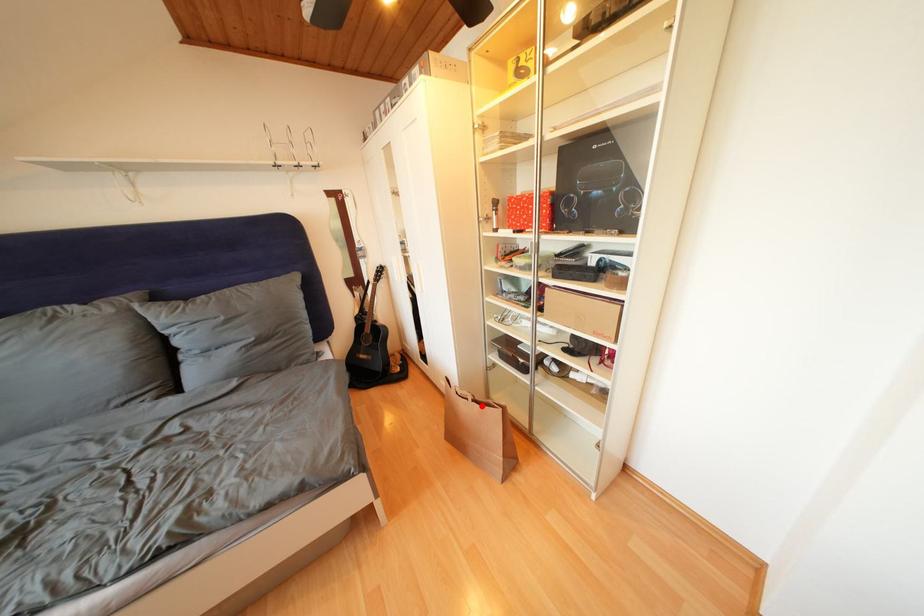
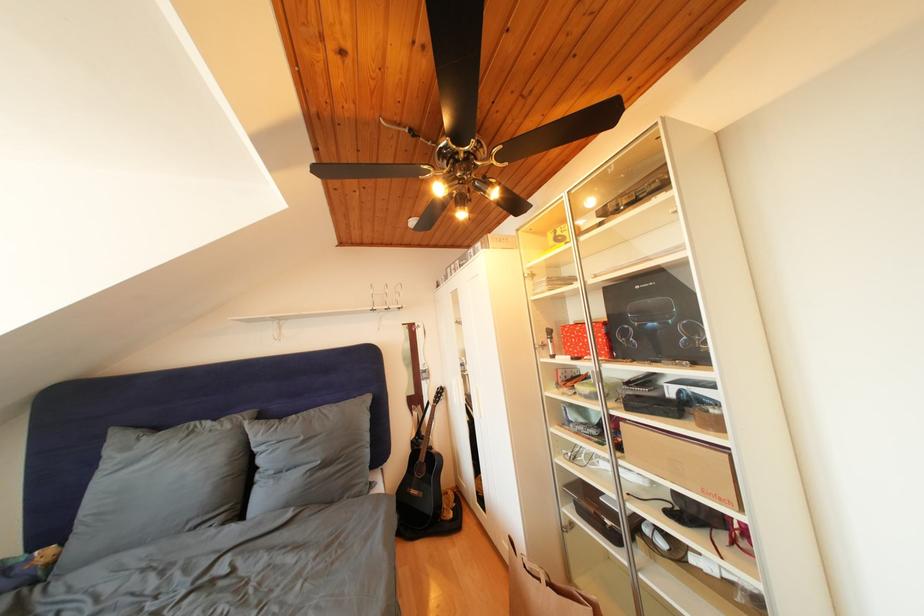
The point at the highlighted location is marked in the first image. Where is the corresponding point in the second image?

(556, 590)